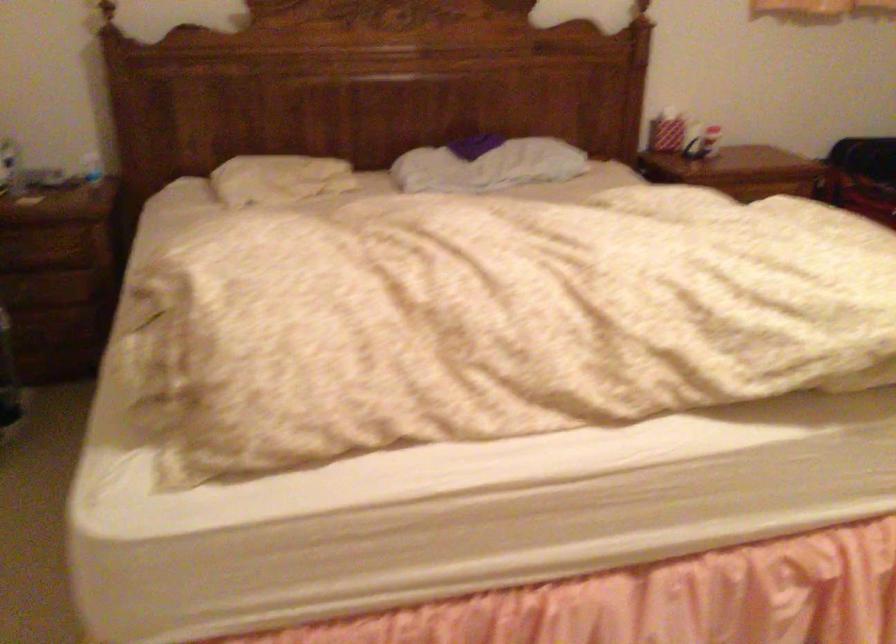
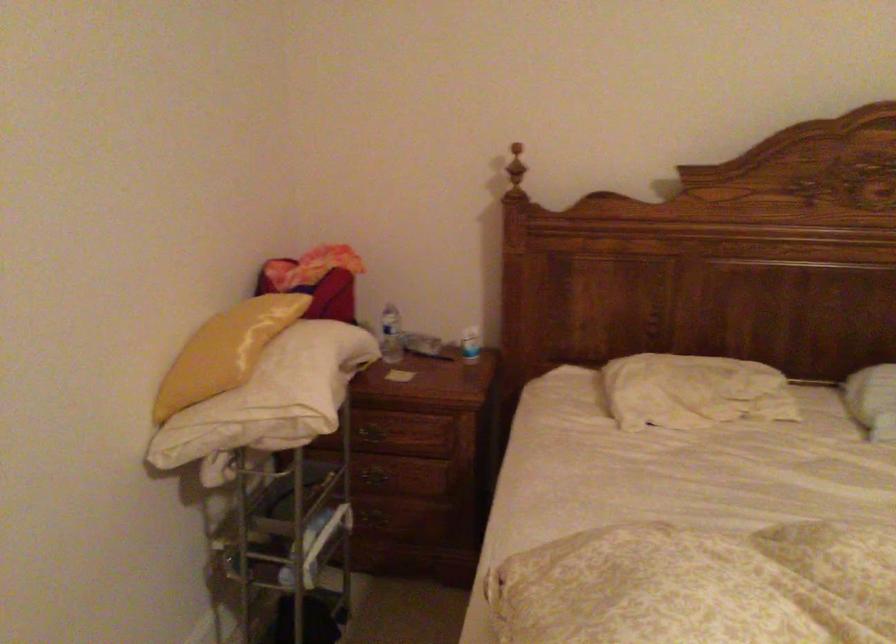
The images are taken continuously from a first-person perspective. In which direction are you moving?

The cameraman moved toward left, forward.